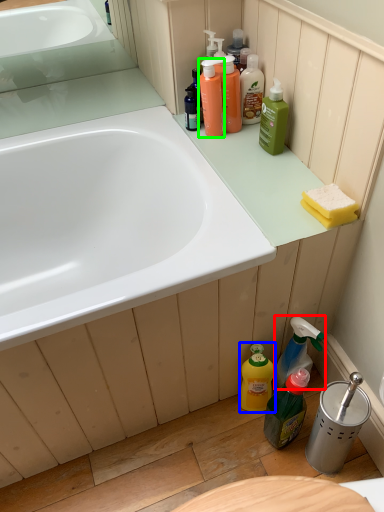
Question: Based on their relative distances, which object is nearer to cleaning product (highlighted by a red box)? Choose from cleaning product (highlighted by a blue box) and cleaning product (highlighted by a green box).

Choices:
 (A) cleaning product
 (B) cleaning product

Answer: (A)